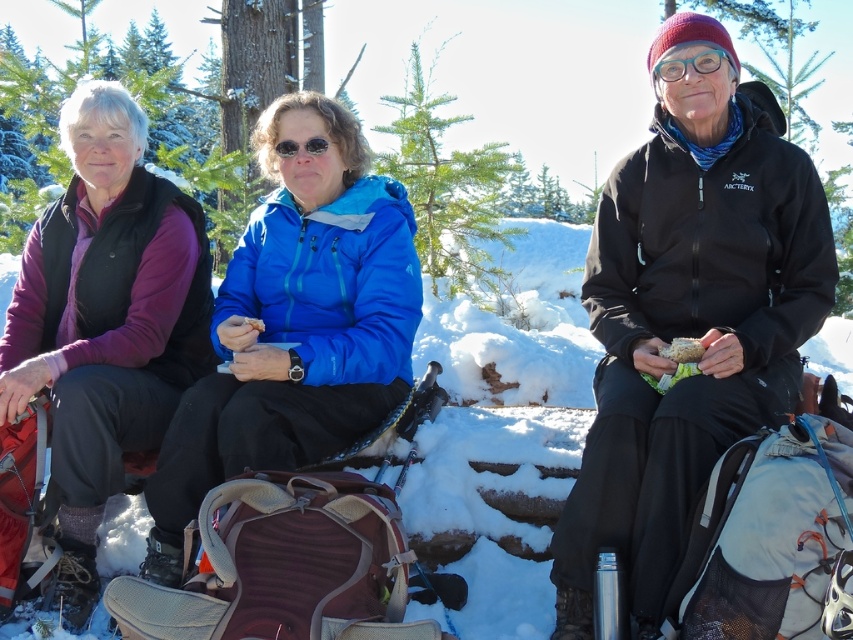
You are a photographer trying to capture a closeup of the matte plastic sandwich at center. You notice the transparent blue goggles at center are blocking your view. Which object should you move to the left to get the sandwich in frame?

You should move the transparent blue goggles at center to the left since it is to the right of the matte plastic sandwich at center.

You are planning to take a photo of the three people in the snowy setting. You want to ensure that both the point at (718, 285) and the point at (677, 362) are visible in the frame. Based on their spatial relationship, which point should be positioned closer to the back of the image to maintain both in the shot?

Point at (718, 285) should be positioned closer to the back of the image because it is behind point at (677, 362), so placing it further back in the frame will keep both visible.